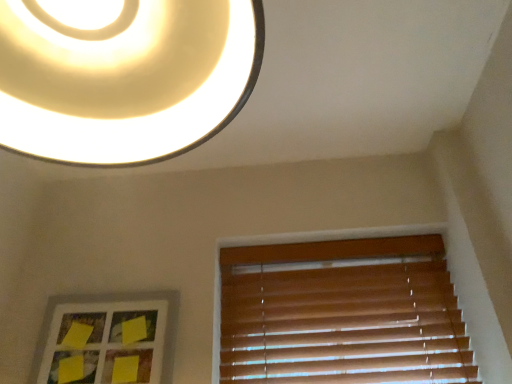
Question: Is matte white lampshade at upper center shorter than yellow paper at lower left?

Choices:
 (A) yes
 (B) no

Answer: (B)

Question: Is matte white lampshade at upper center positioned beyond the bounds of yellow paper at lower left?

Choices:
 (A) no
 (B) yes

Answer: (B)

Question: Is matte white lampshade at upper center positioned far away from yellow paper at lower left?

Choices:
 (A) yes
 (B) no

Answer: (B)

Question: From the image's perspective, is matte white lampshade at upper center beneath yellow paper at lower left?

Choices:
 (A) yes
 (B) no

Answer: (B)

Question: Is matte white lampshade at upper center further to camera compared to yellow paper at lower left?

Choices:
 (A) no
 (B) yes

Answer: (A)

Question: Considering the relative sizes of matte white lampshade at upper center and yellow paper at lower left in the image provided, is matte white lampshade at upper center thinner than yellow paper at lower left?

Choices:
 (A) yes
 (B) no

Answer: (B)

Question: Is matte white lampshade at upper center bigger than wooden blinds at lower right?

Choices:
 (A) no
 (B) yes

Answer: (B)

Question: From the image's perspective, is matte white lampshade at upper center located above wooden blinds at lower right?

Choices:
 (A) no
 (B) yes

Answer: (B)

Question: From a real-world perspective, is matte white lampshade at upper center located higher than wooden blinds at lower right?

Choices:
 (A) no
 (B) yes

Answer: (B)

Question: Is matte white lampshade at upper center not within wooden blinds at lower right?

Choices:
 (A) no
 (B) yes

Answer: (B)

Question: Is matte white lampshade at upper center facing away from wooden blinds at lower right?

Choices:
 (A) no
 (B) yes

Answer: (B)

Question: Is matte white lampshade at upper center not close to wooden blinds at lower right?

Choices:
 (A) yes
 (B) no

Answer: (A)

Question: Is yellow paper at lower left directly adjacent to matte white lampshade at upper center?

Choices:
 (A) yes
 (B) no

Answer: (B)